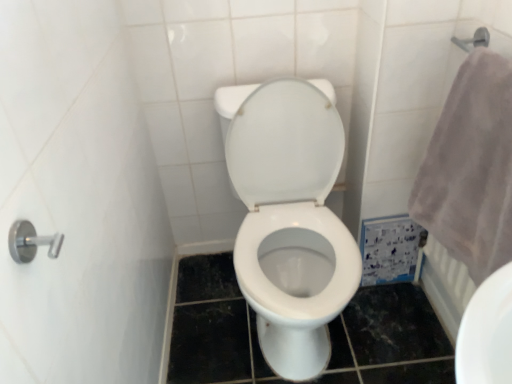
Question: Visually, is gray fluffy towel at right positioned to the left or to the right of white glossy toilet at center?

Choices:
 (A) left
 (B) right

Answer: (B)

Question: Is gray fluffy towel at right situated inside white glossy toilet at center or outside?

Choices:
 (A) outside
 (B) inside

Answer: (A)

Question: Is gray fluffy towel at right wider or thinner than white glossy toilet at center?

Choices:
 (A) wide
 (B) thin

Answer: (B)

Question: Does point (311, 367) appear closer or farther from the camera than point (456, 253)?

Choices:
 (A) farther
 (B) closer

Answer: (A)

Question: In terms of height, does white glossy toilet at center look taller or shorter compared to gray fluffy towel at right?

Choices:
 (A) short
 (B) tall

Answer: (B)

Question: Based on their sizes in the image, would you say white glossy toilet at center is bigger or smaller than gray fluffy towel at right?

Choices:
 (A) big
 (B) small

Answer: (A)

Question: From the image's perspective, is white glossy toilet at center located above or below gray fluffy towel at right?

Choices:
 (A) above
 (B) below

Answer: (B)